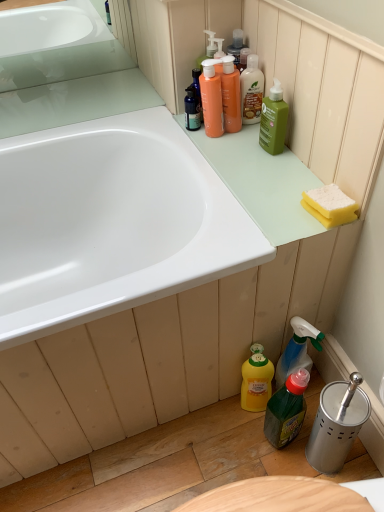
Question: From a real-world perspective, is translucent plastic mouthwash at upper center located higher than yellow matte bottle at lower center, the fifth cleaning product in the top-to-bottom sequence?

Choices:
 (A) no
 (B) yes

Answer: (B)

Question: Is translucent plastic mouthwash at upper center beside yellow matte bottle at lower center, positioned as the 1th cleaning product in bottom-to-top order?

Choices:
 (A) no
 (B) yes

Answer: (A)

Question: Is translucent plastic mouthwash at upper center facing away from yellow matte bottle at lower center, positioned as the 1th cleaning product in bottom-to-top order?

Choices:
 (A) yes
 (B) no

Answer: (B)

Question: From a real-world perspective, is translucent plastic mouthwash at upper center positioned under yellow matte bottle at lower center, positioned as the 1th cleaning product in bottom-to-top order, based on gravity?

Choices:
 (A) yes
 (B) no

Answer: (B)

Question: Is translucent plastic mouthwash at upper center positioned before yellow matte bottle at lower center, the fifth cleaning product in the top-to-bottom sequence?

Choices:
 (A) no
 (B) yes

Answer: (A)

Question: Considering the relative sizes of translucent plastic mouthwash at upper center and yellow matte bottle at lower center, the fifth cleaning product in the top-to-bottom sequence, in the image provided, is translucent plastic mouthwash at upper center shorter than yellow matte bottle at lower center, the fifth cleaning product in the top-to-bottom sequence,?

Choices:
 (A) yes
 (B) no

Answer: (A)

Question: Is yellow matte bottle at lower center, positioned as the 1th cleaning product in bottom-to-top order, turned away from translucent plastic spray bottle at lower right, which is the fourth cleaning product in top-to-bottom order?

Choices:
 (A) yes
 (B) no

Answer: (A)

Question: From the image's perspective, is yellow matte bottle at lower center, positioned as the 1th cleaning product in bottom-to-top order, located beneath translucent plastic spray bottle at lower right, which is counted as the 2th cleaning product, starting from the bottom?

Choices:
 (A) no
 (B) yes

Answer: (B)

Question: Considering the relative positions of yellow matte bottle at lower center, the fifth cleaning product in the top-to-bottom sequence, and translucent plastic spray bottle at lower right, which is the fourth cleaning product in top-to-bottom order, in the image provided, is yellow matte bottle at lower center, the fifth cleaning product in the top-to-bottom sequence, to the left of translucent plastic spray bottle at lower right, which is the fourth cleaning product in top-to-bottom order, from the viewer's perspective?

Choices:
 (A) no
 (B) yes

Answer: (B)

Question: Is yellow matte bottle at lower center, positioned as the 1th cleaning product in bottom-to-top order, shorter than translucent plastic spray bottle at lower right, which is the fourth cleaning product in top-to-bottom order?

Choices:
 (A) yes
 (B) no

Answer: (A)

Question: Considering the relative sizes of yellow matte bottle at lower center, the fifth cleaning product in the top-to-bottom sequence, and translucent plastic spray bottle at lower right, which is counted as the 2th cleaning product, starting from the bottom, in the image provided, is yellow matte bottle at lower center, the fifth cleaning product in the top-to-bottom sequence, bigger than translucent plastic spray bottle at lower right, which is counted as the 2th cleaning product, starting from the bottom,?

Choices:
 (A) yes
 (B) no

Answer: (B)

Question: Does yellow matte bottle at lower center, the fifth cleaning product in the top-to-bottom sequence, come in front of translucent plastic spray bottle at lower right, which is counted as the 2th cleaning product, starting from the bottom?

Choices:
 (A) yes
 (B) no

Answer: (B)

Question: Is translucent plastic mouthwash at upper center oriented away from translucent green bottle at lower center?

Choices:
 (A) no
 (B) yes

Answer: (A)